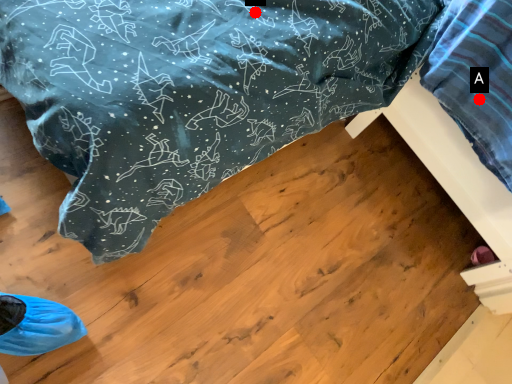
Question: Two points are circled on the image, labeled by A and B beside each circle. Which point is closer to the camera taking this photo?

Choices:
 (A) A is closer
 (B) B is closer

Answer: (B)